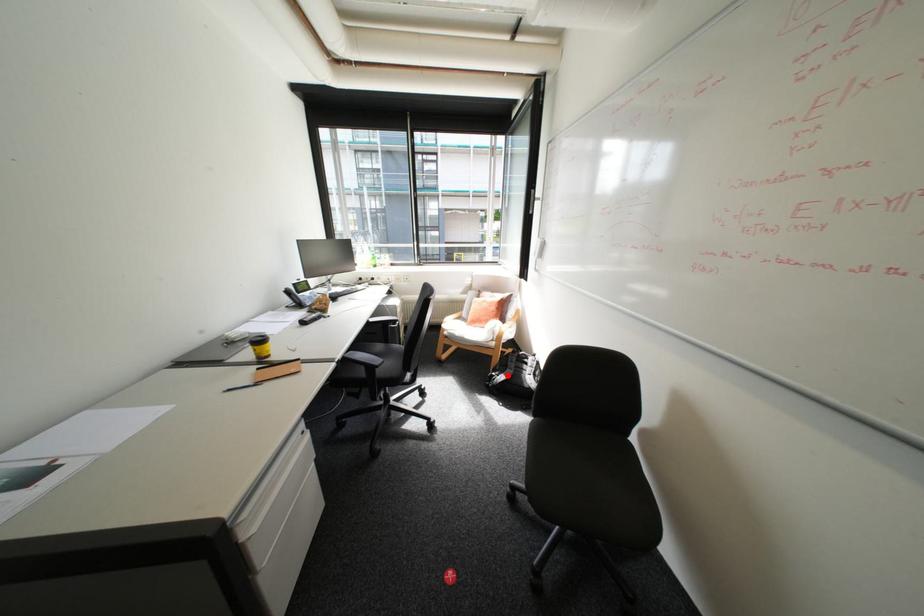
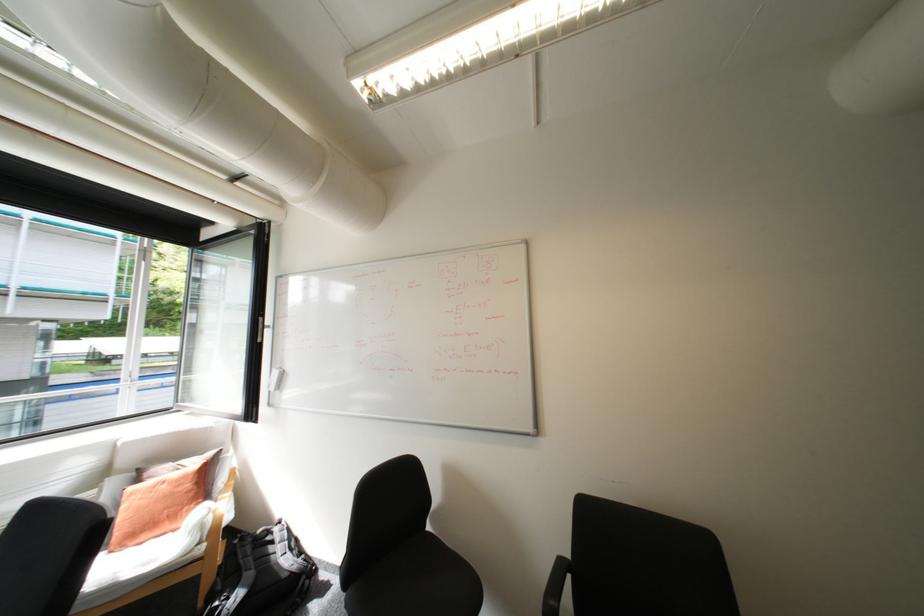
Question: I am providing you with two images of the same scene from different viewpoints. A red point is shown in image1. For the corresponding object point in image2, is it positioned nearer or farther from the camera?

Choices:
 (A) Nearer
 (B) Farther

Answer: (A)